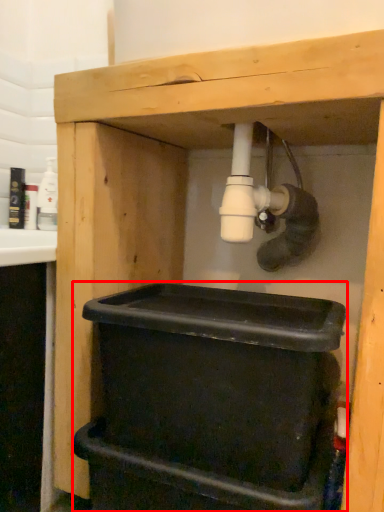
Question: In this image, where is recycling bin (annotated by the red box) located relative to bottle?

Choices:
 (A) left
 (B) right

Answer: (B)